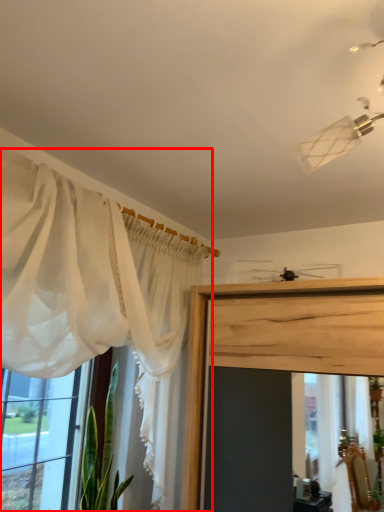
Question: From the image's perspective, where is curtain (annotated by the red box) located relative to window?

Choices:
 (A) above
 (B) below

Answer: (A)